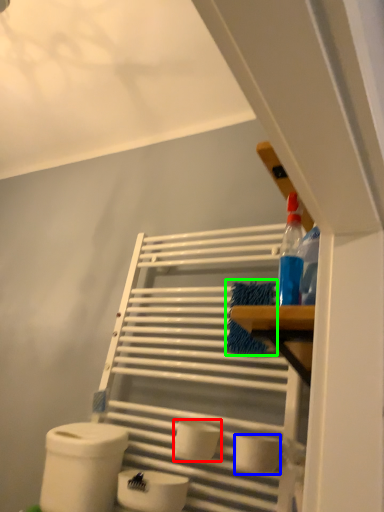
Question: Considering the real-world distances, which object is farthest from toilet paper (highlighted by a red box)? toilet paper (highlighted by a blue box) or material (highlighted by a green box)?

Choices:
 (A) toilet paper
 (B) material

Answer: (B)